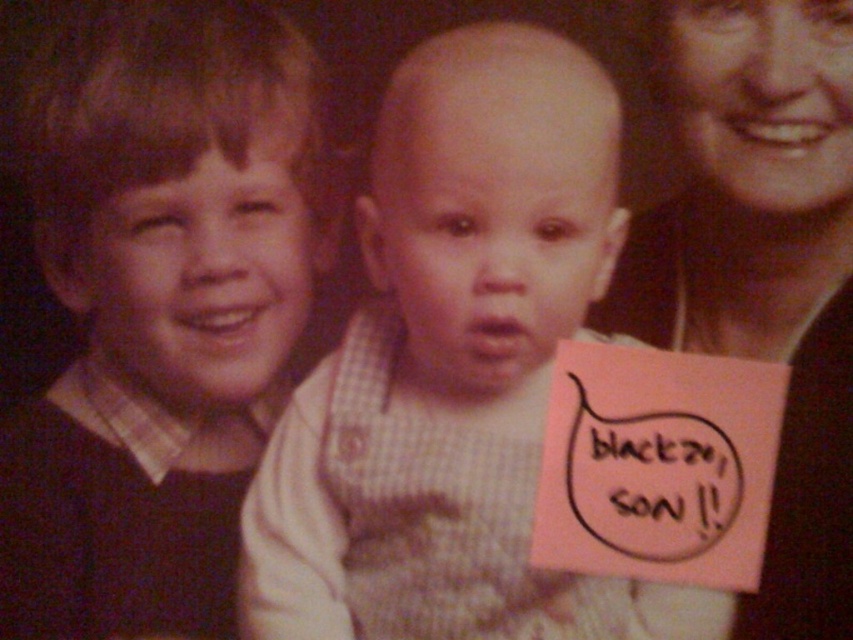
You are a photographer analyzing this vintage photo. You notice two points labeled in the image. Which point is closer to you, point at coordinate [54,234] or point at coordinate [817,337]?

Point at coordinate [54,234] is closer to you than point at coordinate [817,337] because it is further to the viewer according to the description.

You are organizing a clothing donation drive and need to determine which item is more suitable for a child. Based on the image, which item is larger between the checkered fabric shirt at center and the matte black sweater at left?

The checkered fabric shirt at center is larger in size than the matte black sweater at left, so it is more suitable for a child.

You are a photographer examining this vintage image. You notice the checkered fabric shirt at center and the smooth skin face at upper right. Which object is nearer to the camera lens?

The checkered fabric shirt at center is closer to the viewer than the smooth skin face at upper right, so the checkered fabric shirt at center is nearer to the camera lens.